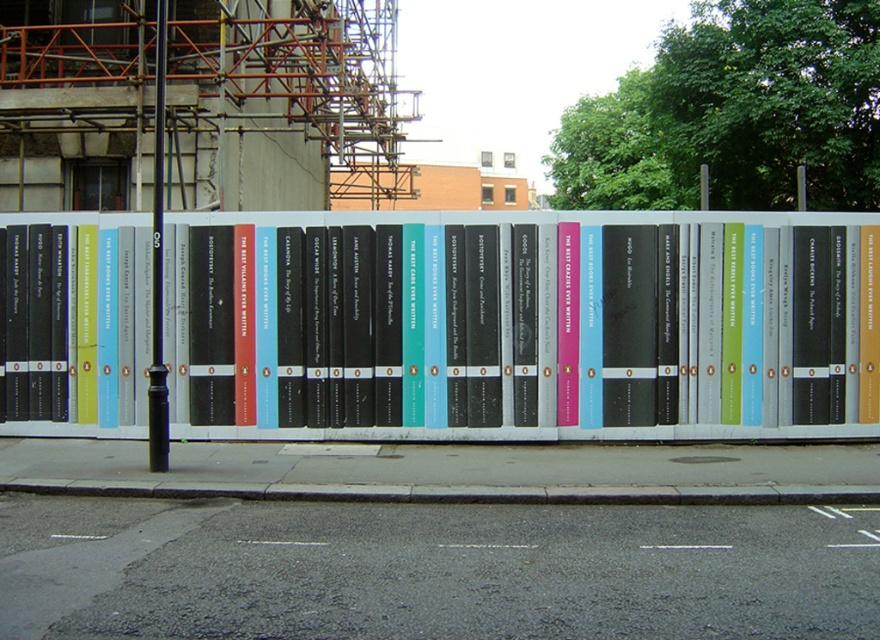
You are a construction worker standing at the edge of the street. You need to secure a safety harness to a sturdy object. Which object should you choose between the metallic bookshelf at center and the black metal pole at center?

The black metal pole at center is the sturdiest option because the metallic bookshelf at center is positioned under it, suggesting the pole is a support structure designed to bear weight.

You are a pedestrian walking along the street and see the metallic bookshelf at center and the gray concrete curb at lower center. Which object is located to the left of the other?

The metallic bookshelf at center is positioned on the left side of gray concrete curb at lower center, so it is to the left of the curb.